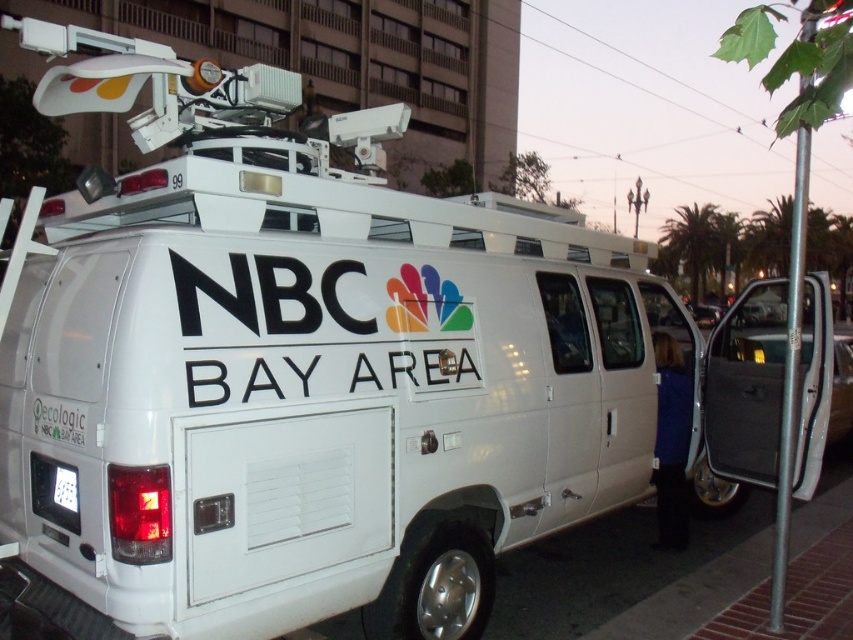
Between white plastic license plate at lower left and white plastic license plate at rear, which one has less height?

With less height is white plastic license plate at rear.

Who is more forward, (35, 484) or (65, 502)?

Point (65, 502) is in front.

Which is behind, point (51, 486) or point (59, 492)?

Positioned behind is point (51, 486).

Image resolution: width=853 pixels, height=640 pixels. Identify the location of white plastic license plate at lower left. (54, 492).